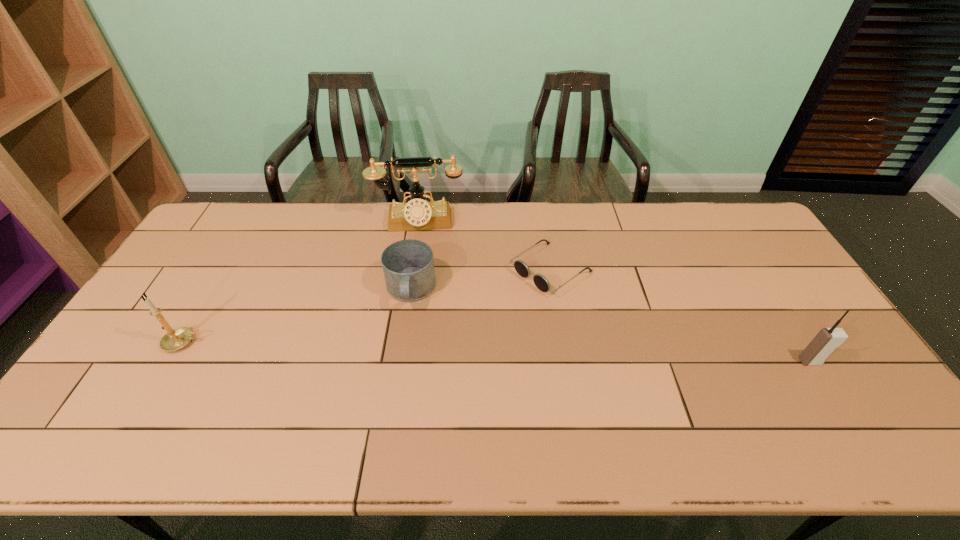
Find the location of a particular element. free spot on the desktop that is between the fourth farthest object and the rightmost object and is positioned on the front-facing side of the sunglasses is located at coordinates (435, 350).

The height and width of the screenshot is (540, 960). What are the coordinates of `vacant spot on the desktop that is between the second nearest object and the cellular telephone and is positioned on the dial of the telephone` in the screenshot? It's located at (415, 349).

Find the location of a particular element. The height and width of the screenshot is (540, 960). vacant spot on the desktop that is between the second nearest object and the nearest object and is positioned on the side of the mug with the handle is located at coordinates (405, 349).